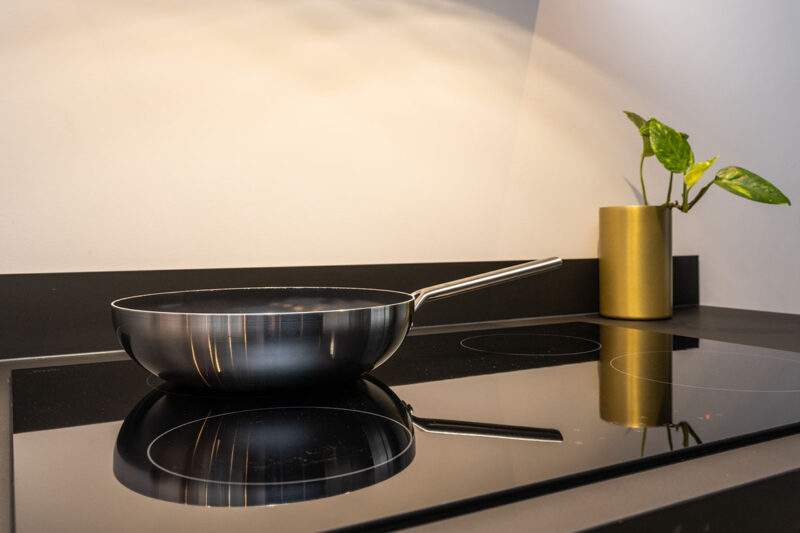
Where is `the front right burner`? This screenshot has width=800, height=533. the front right burner is located at coordinates (726, 357).